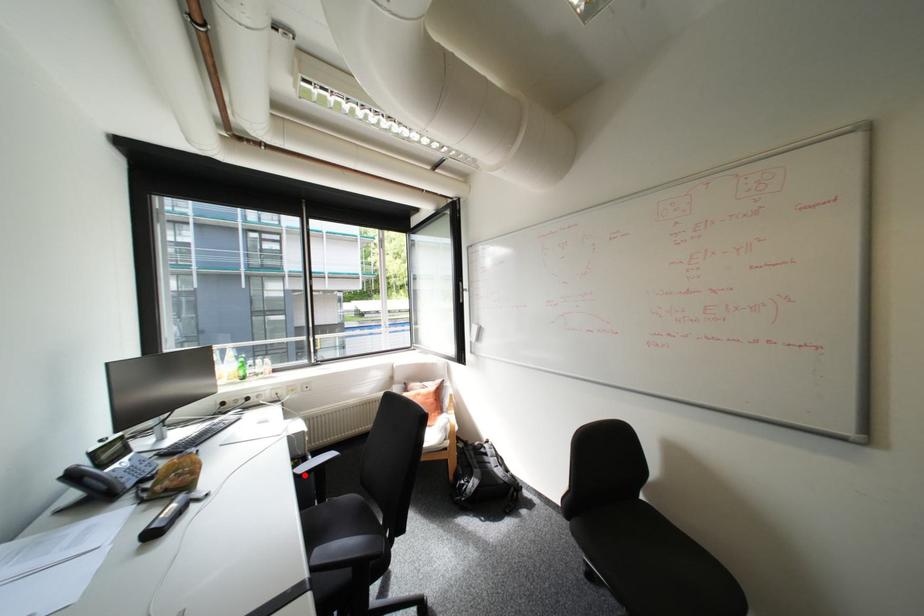
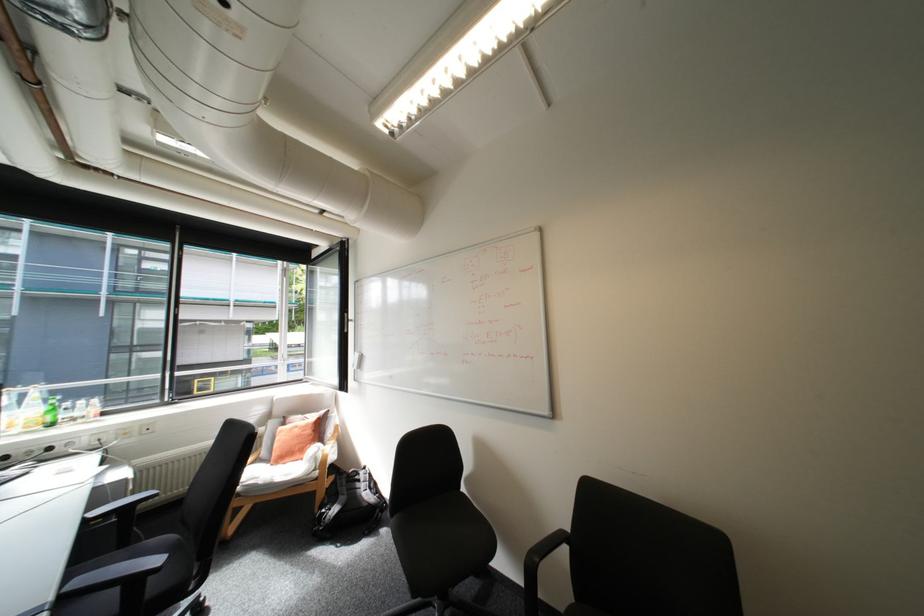
Where in the second image is the point corresponding to the highlighted location from the first image?

(94, 519)